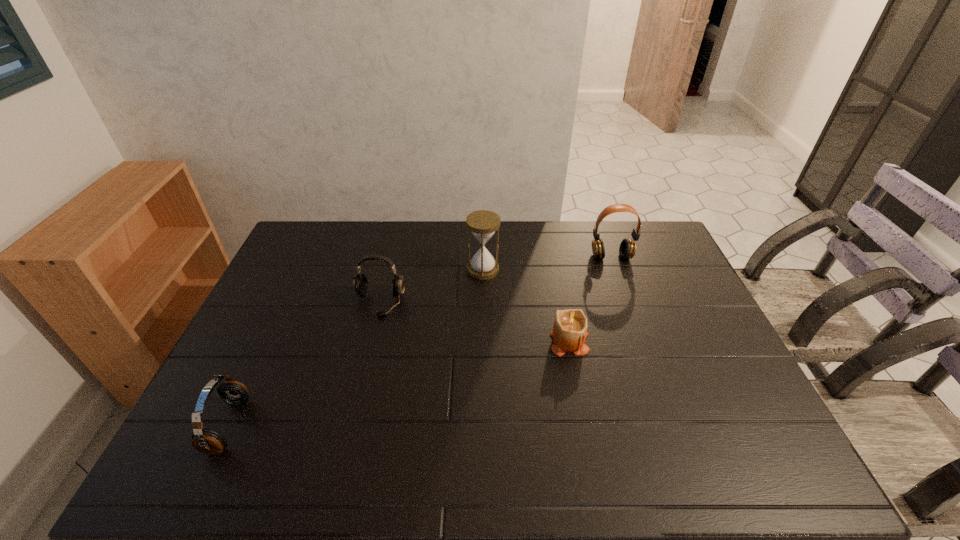
Where is `the third object from right to left`? The height and width of the screenshot is (540, 960). the third object from right to left is located at coordinates (482, 223).

The image size is (960, 540). I want to click on the rightmost object, so click(627, 249).

The width and height of the screenshot is (960, 540). I want to click on the farthest headset, so click(627, 249).

Identify the location of the second nearest headset. (360, 282).

Locate an element on the screen. This screenshot has width=960, height=540. the second headset from left to right is located at coordinates (360, 282).

At what (x,y) coordinates should I click in order to perform the action: click on the leftmost object. Please return your answer as a coordinate pair (x, y). This screenshot has height=540, width=960. Looking at the image, I should click on (208, 441).

Locate an element on the screen. Image resolution: width=960 pixels, height=540 pixels. the nearest object is located at coordinates (208, 441).

Locate an element on the screen. the fourth farthest object is located at coordinates (569, 333).

At what (x,y) coordinates should I click in order to perform the action: click on candle. Please return your answer as a coordinate pair (x, y). The height and width of the screenshot is (540, 960). Looking at the image, I should click on (569, 333).

Image resolution: width=960 pixels, height=540 pixels. What are the coordinates of `free spot located 0.190m on the right of the hourglass` in the screenshot? It's located at click(554, 269).